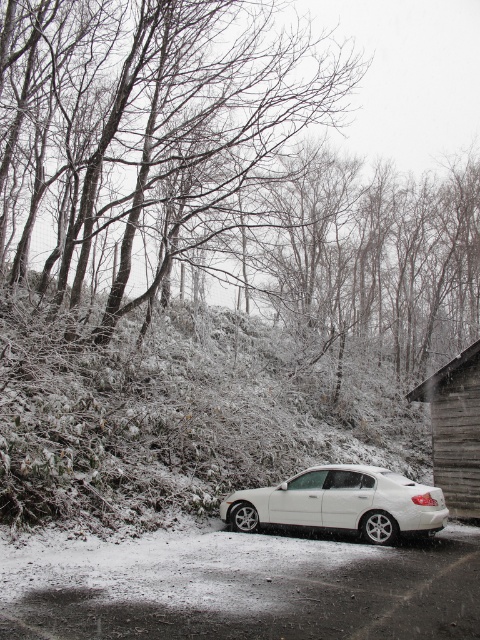
From the picture: Is snow-covered branches at upper left wider than wooden cabin at right?

Yes.

Looking at this image, is snow-covered branches at upper left above wooden cabin at right?

Yes, snow-covered branches at upper left is above wooden cabin at right.

Where is `snow-covered branches at upper left`? This screenshot has height=640, width=480. snow-covered branches at upper left is located at coordinates (153, 129).

This screenshot has height=640, width=480. In order to click on snow-covered branches at upper left in this screenshot , I will do `click(153, 129)`.

Is snow-covered branches at upper left further to camera compared to white matte sedan at center?

Yes, snow-covered branches at upper left is further from the viewer.

Is point (189, 54) less distant than point (433, 515)?

No, it is behind (433, 515).

Find the location of a particular element. The height and width of the screenshot is (640, 480). snow-covered branches at upper left is located at coordinates (153, 129).

Who is shorter, white matte sedan at center or wooden cabin at right?

white matte sedan at center

Does white matte sedan at center come behind wooden cabin at right?

No, it is not.

Does point (410, 509) lie behind point (425, 396)?

No, it is not.

You are a GUI agent. You are given a task and a screenshot of the screen. Output one action in this format:
    pyautogui.click(x=<x>, y=<y>)
    Task: Click on the white matte sedan at center
    
    Given the screenshot: What is the action you would take?
    pyautogui.click(x=340, y=502)